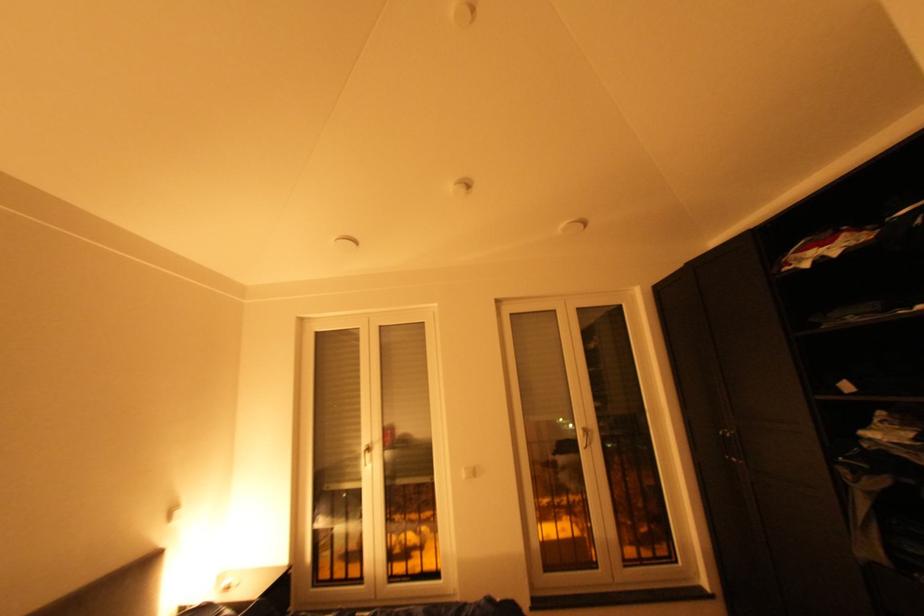
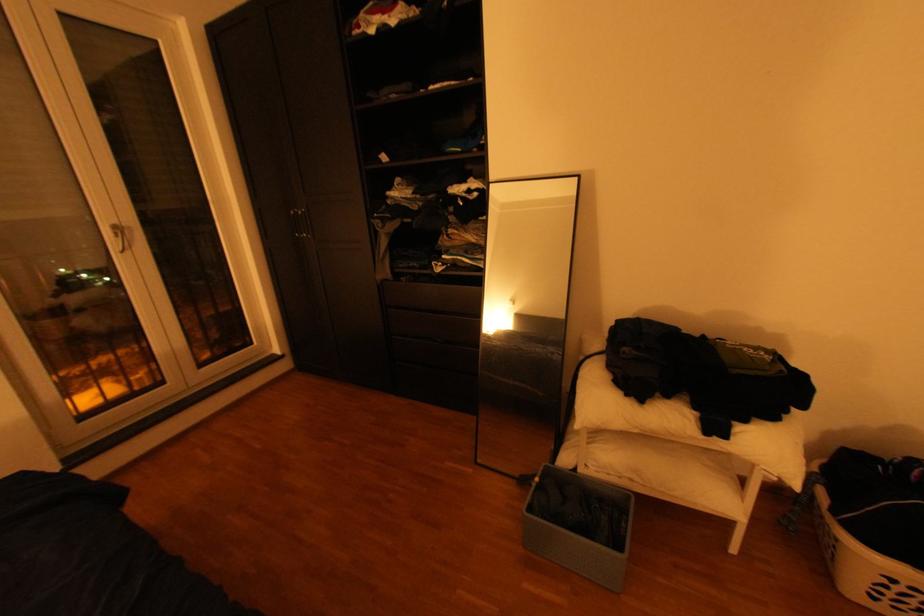
In the second image, find the point that corresponds to pixel 590 428 in the first image.

(117, 225)